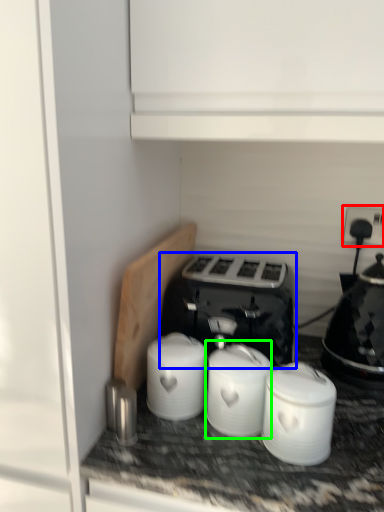
Question: Which object is positioned farthest from electric outlet (highlighted by a red box)? Select from toaster (highlighted by a blue box) and appliance (highlighted by a green box).

Choices:
 (A) toaster
 (B) appliance

Answer: (B)